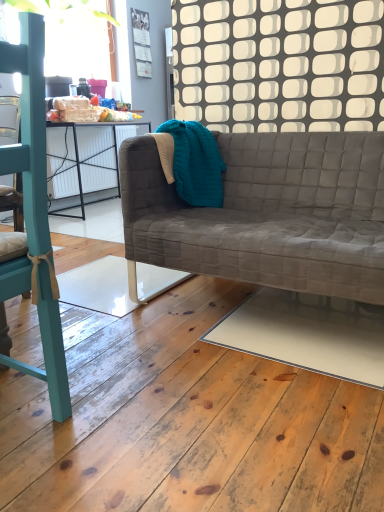
Question: Considering the positions of point (29, 178) and point (139, 30), is point (29, 178) closer or farther from the camera than point (139, 30)?

Choices:
 (A) farther
 (B) closer

Answer: (B)

Question: Is teal painted wood chair at left situated inside matte paper calendar at upper center or outside?

Choices:
 (A) inside
 (B) outside

Answer: (B)

Question: Which is nearer to the matte paper calendar at upper center?

Choices:
 (A) teal knitted blanket at upper center
 (B) teal painted wood chair at left
 (C) white glossy plywood at lower center
 (D) textured gray couch at center

Answer: (A)

Question: Considering the real-world distances, which object is farthest from the teal painted wood chair at left?

Choices:
 (A) matte paper calendar at upper center
 (B) textured gray couch at center
 (C) white glossy plywood at lower center
 (D) teal knitted blanket at upper center

Answer: (A)